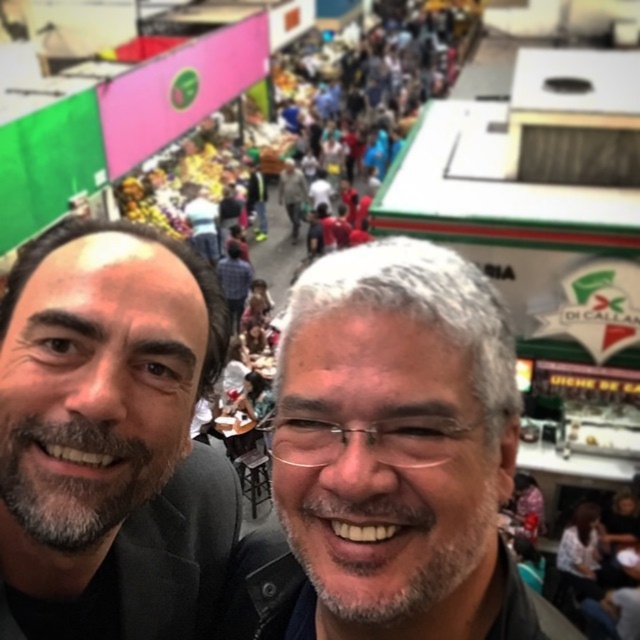
Can you confirm if gray hair at center is wider than smooth black suit at left?

No, gray hair at center is not wider than smooth black suit at left.

Between point (492, 401) and point (51, 528), which one is positioned behind?

The point (492, 401) is behind.

The image size is (640, 640). I want to click on gray hair at center, so click(388, 456).

Where is `gray hair at center`? The image size is (640, 640). gray hair at center is located at coordinates (388, 456).